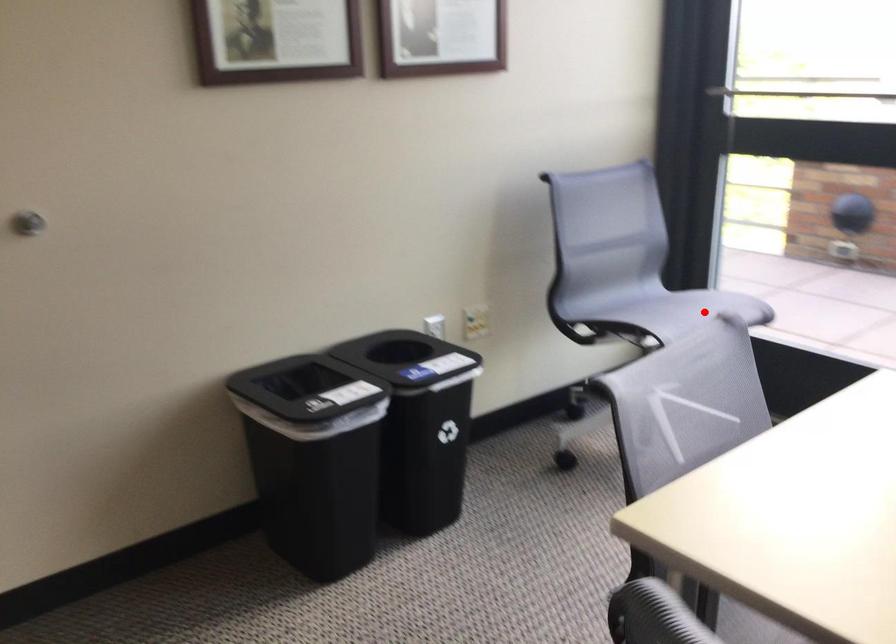
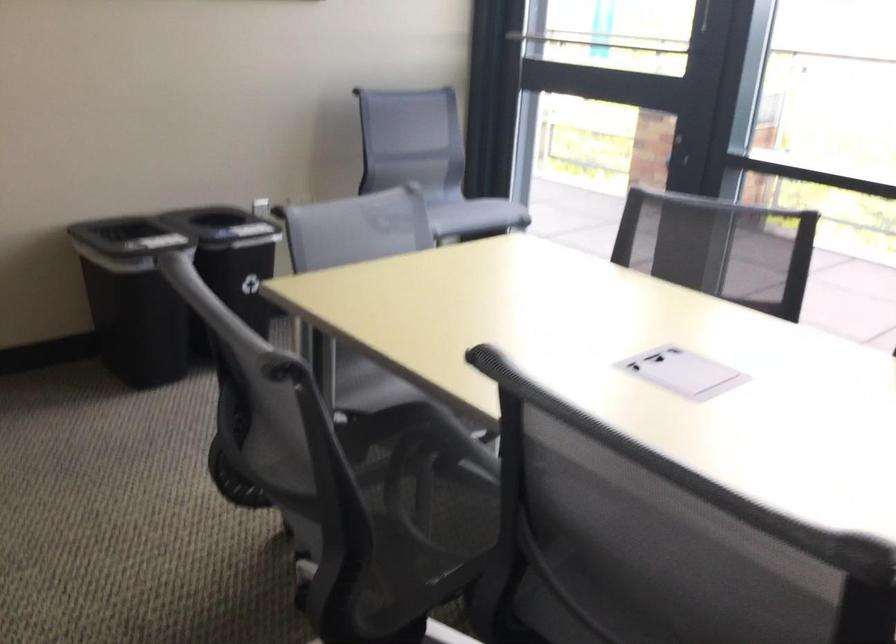
Find the pixel in the second image that matches the highlighted location in the first image.

(470, 213)